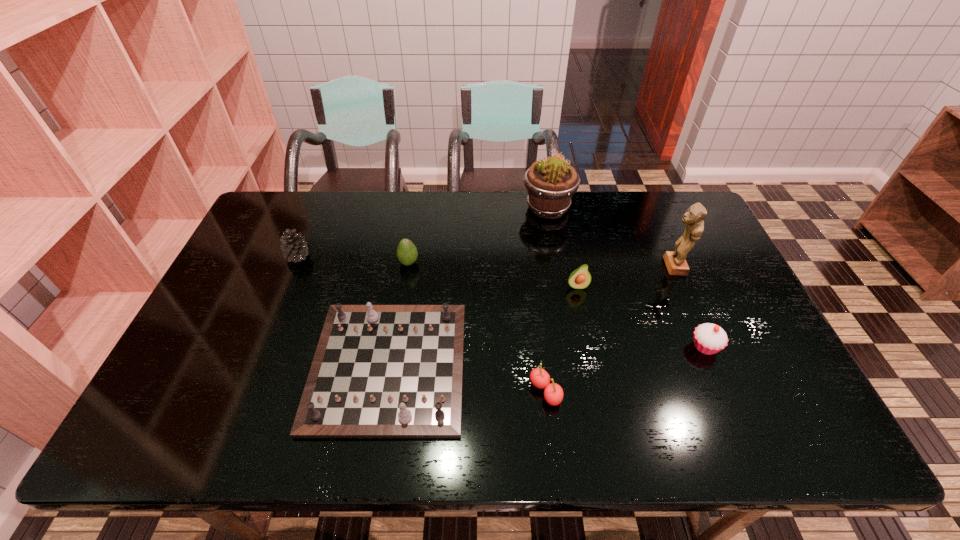
Locate an element on the screen. This screenshot has height=540, width=960. vacant position in the image that satisfies the following two spatial constraints: 1. on the front-facing side of the figurine; 2. on the front side of the cupcake is located at coordinates (708, 347).

Identify the location of free space that satisfies the following two spatial constraints: 1. on the cut side of the cupcake; 2. on the right side of the right avocado. (589, 347).

Locate an element on the screen. This screenshot has height=540, width=960. free region that satisfies the following two spatial constraints: 1. on the board of the chessboard; 2. on the left side of the cherry is located at coordinates (384, 392).